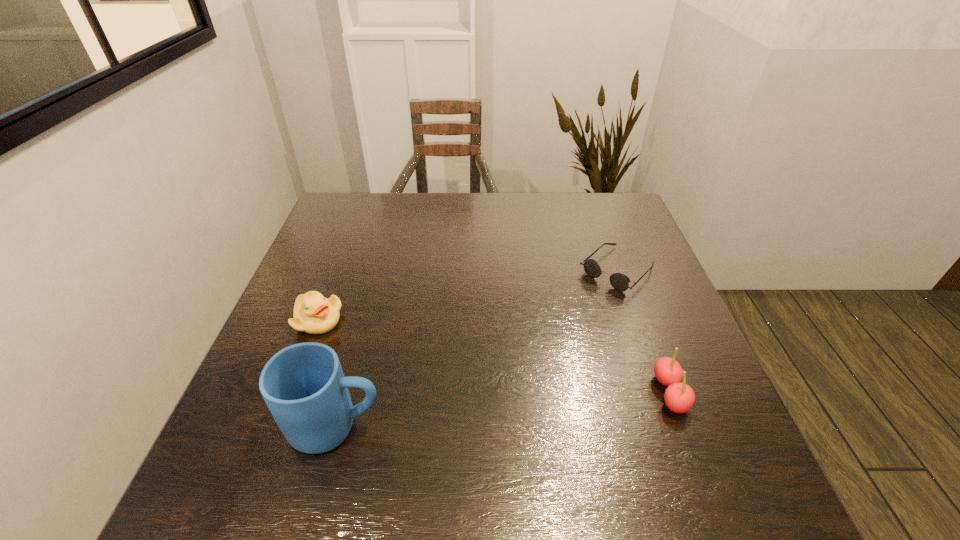
The height and width of the screenshot is (540, 960). What are the coordinates of `free space that satisfies the following two spatial constraints: 1. on the front side of the cherry; 2. on the right side of the third nearest object` in the screenshot? It's located at (291, 393).

Image resolution: width=960 pixels, height=540 pixels. What are the coordinates of `free space that satisfies the following two spatial constraints: 1. on the front side of the cherry; 2. on the left side of the farthest object` in the screenshot? It's located at (662, 393).

Where is `vacant region that satisfies the following two spatial constraints: 1. on the back side of the third nearest object; 2. on the right side of the sunglasses`? This screenshot has width=960, height=540. vacant region that satisfies the following two spatial constraints: 1. on the back side of the third nearest object; 2. on the right side of the sunglasses is located at coordinates (337, 270).